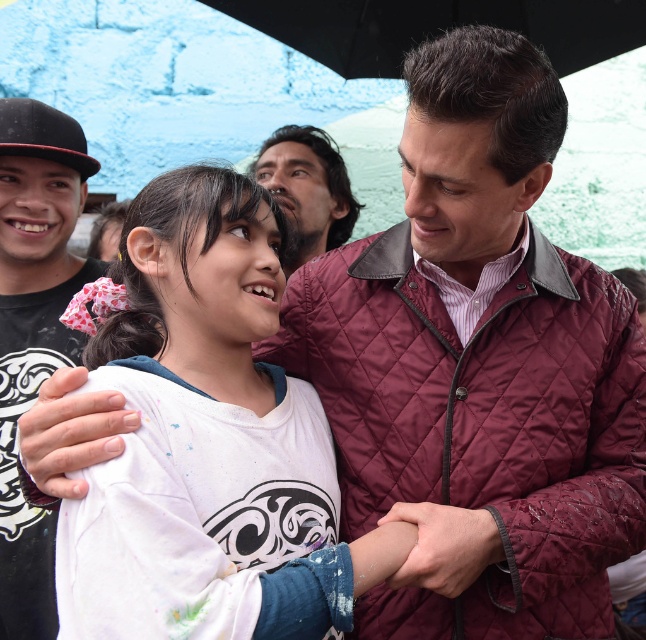
Between white cotton shirt at center and dark brown hair at upper center, which one has more height?

white cotton shirt at center is taller.

Is white cotton shirt at center behind dark brown hair at upper center?

No, white cotton shirt at center is closer to the viewer.

Between point (320, 449) and point (304, 140), which one is positioned behind?

The point (304, 140) is more distant.

You are a GUI agent. You are given a task and a screenshot of the screen. Output one action in this format:
    pyautogui.click(x=<x>, y=<y>)
    Task: Click on the white cotton shirt at center
    
    Given the screenshot: What is the action you would take?
    pyautogui.click(x=234, y=378)

Is point (266, 408) positioned behind point (3, 512)?

No.

Can you confirm if white cotton shirt at center is bigger than black quilted jacket at left?

Yes.

Where is `white cotton shirt at center`? The height and width of the screenshot is (640, 646). white cotton shirt at center is located at coordinates (234, 378).

Identify the location of black quilted jacket at left. point(34,330).

Is black quilted jacket at left to the left of black matte umbrella at upper center from the viewer's perspective?

Correct, you'll find black quilted jacket at left to the left of black matte umbrella at upper center.

Does point (25, 172) come farther from viewer compared to point (401, 60)?

No, (25, 172) is in front of (401, 60).

At what (x,y) coordinates should I click in order to perform the action: click on black quilted jacket at left. Please return your answer as a coordinate pair (x, y). Image resolution: width=646 pixels, height=640 pixels. Looking at the image, I should click on (34, 330).